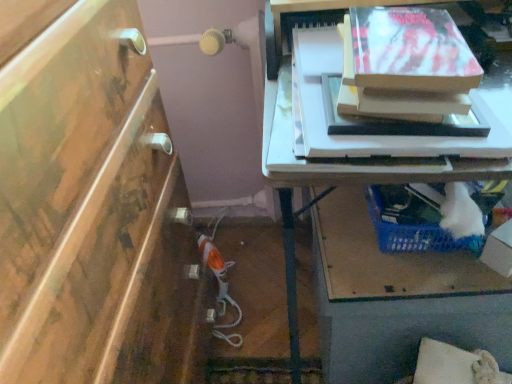
Question: From the image's perspective, is white cardboard box at lower right located above matte cardboard box at upper right?

Choices:
 (A) no
 (B) yes

Answer: (A)

Question: Can you confirm if white cardboard box at lower right is positioned to the left of matte cardboard box at upper right?

Choices:
 (A) no
 (B) yes

Answer: (A)

Question: Is white cardboard box at lower right with matte cardboard box at upper right?

Choices:
 (A) no
 (B) yes

Answer: (A)

Question: Does white cardboard box at lower right have a smaller size compared to matte cardboard box at upper right?

Choices:
 (A) no
 (B) yes

Answer: (B)

Question: From the image's perspective, would you say white cardboard box at lower right is shown under matte cardboard box at upper right?

Choices:
 (A) no
 (B) yes

Answer: (B)

Question: Looking at their shapes, would you say matte cardboard box at upper right is wider or thinner than white cardboard box at lower right?

Choices:
 (A) thin
 (B) wide

Answer: (B)

Question: In the image, is matte cardboard box at upper right positioned in front of or behind white cardboard box at lower right?

Choices:
 (A) front
 (B) behind

Answer: (A)

Question: Visually, is matte cardboard box at upper right positioned to the left or to the right of white cardboard box at lower right?

Choices:
 (A) right
 (B) left

Answer: (B)

Question: Is matte cardboard box at upper right situated inside white cardboard box at lower right or outside?

Choices:
 (A) inside
 (B) outside

Answer: (B)

Question: Is blue plastic basket at lower right wider or thinner than white cardboard box at lower right?

Choices:
 (A) wide
 (B) thin

Answer: (A)

Question: Considering their positions, is blue plastic basket at lower right located in front of or behind white cardboard box at lower right?

Choices:
 (A) behind
 (B) front

Answer: (A)

Question: Is blue plastic basket at lower right to the left or to the right of white cardboard box at lower right in the image?

Choices:
 (A) right
 (B) left

Answer: (B)

Question: From the image's perspective, is blue plastic basket at lower right positioned above or below white cardboard box at lower right?

Choices:
 (A) below
 (B) above

Answer: (A)

Question: From the image's perspective, is white cardboard box at lower right positioned above or below blue plastic basket at lower right?

Choices:
 (A) below
 (B) above

Answer: (B)

Question: In terms of height, does white cardboard box at lower right look taller or shorter compared to blue plastic basket at lower right?

Choices:
 (A) tall
 (B) short

Answer: (B)